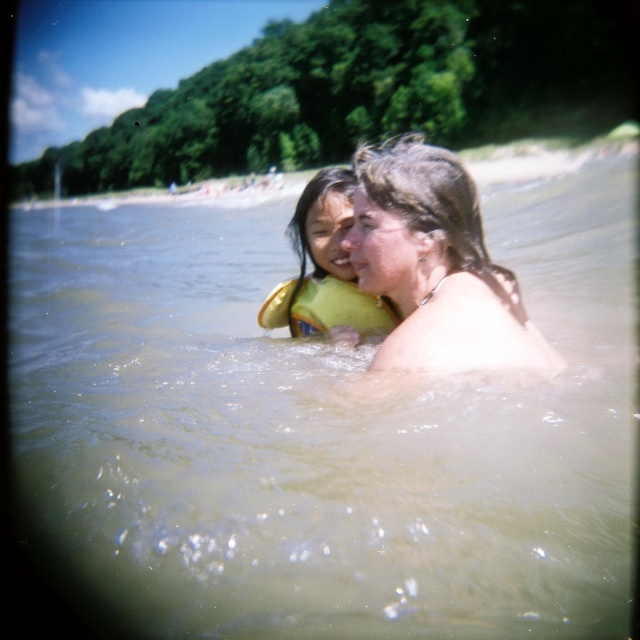
Question: Which object is farther from the camera taking this photo?

Choices:
 (A) yellow fabric life jacket at center
 (B) yellow life vest at center
 (C) matte skin woman at center

Answer: (A)

Question: Is matte skin woman at center smaller than yellow life vest at center?

Choices:
 (A) yes
 (B) no

Answer: (A)

Question: Estimate the real-world distances between objects in this image. Which object is farther from the yellow life vest at center?

Choices:
 (A) yellow fabric life jacket at center
 (B) matte skin woman at center

Answer: (B)

Question: Can you confirm if matte skin woman at center is thinner than yellow fabric life jacket at center?

Choices:
 (A) yes
 (B) no

Answer: (B)

Question: Which of these objects is positioned farthest from the yellow fabric life jacket at center?

Choices:
 (A) yellow life vest at center
 (B) matte skin woman at center

Answer: (B)

Question: From the image, what is the correct spatial relationship of matte skin woman at center in relation to yellow life vest at center?

Choices:
 (A) below
 (B) above

Answer: (A)